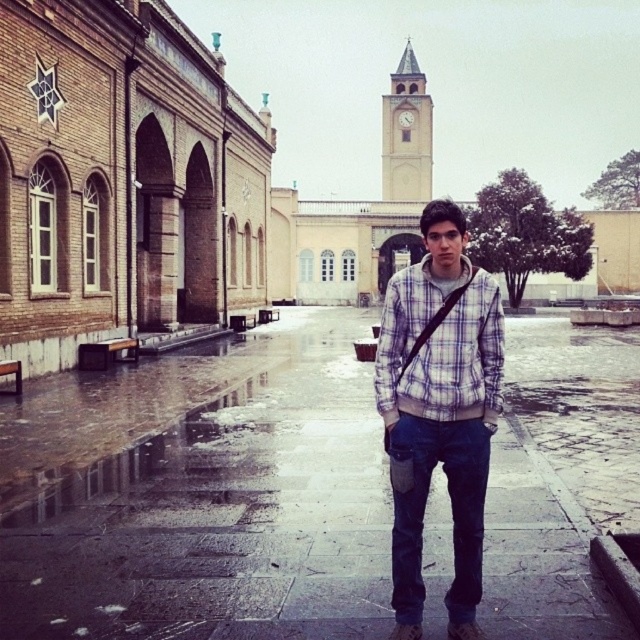
Can you confirm if wet concrete pavement at center is positioned to the right of plaid cotton shirt at center?

Indeed, wet concrete pavement at center is positioned on the right side of plaid cotton shirt at center.

Can you confirm if wet concrete pavement at center is taller than plaid cotton shirt at center?

No.

What do you see at coordinates (221, 516) in the screenshot? This screenshot has width=640, height=640. I see `wet concrete pavement at center` at bounding box center [221, 516].

This screenshot has width=640, height=640. Identify the location of wet concrete pavement at center. (221, 516).

Which is behind, point (272, 586) or point (480, 300)?

Positioned behind is point (272, 586).

I want to click on wet concrete pavement at center, so click(x=221, y=516).

Which of these two, plaid fabric shirt at center or light beige stone clock tower at upper center, stands taller?

With more height is light beige stone clock tower at upper center.

Can you confirm if plaid fabric shirt at center is thinner than light beige stone clock tower at upper center?

Yes.

This screenshot has width=640, height=640. What do you see at coordinates (440, 348) in the screenshot? I see `plaid fabric shirt at center` at bounding box center [440, 348].

Where is `plaid fabric shirt at center`? plaid fabric shirt at center is located at coordinates (440, 348).